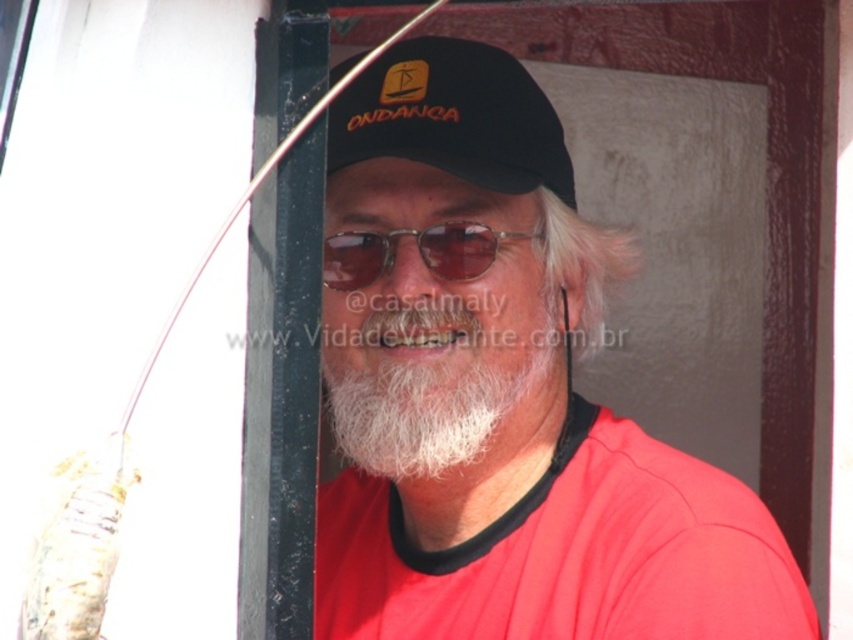
Question: Which object appears closest to the camera in this image?

Choices:
 (A) black matte baseball cap at center
 (B) sunglasses at center

Answer: (A)

Question: Does matte black cap at center have a lesser width compared to sunglasses at center?

Choices:
 (A) yes
 (B) no

Answer: (B)

Question: Which point is closer to the camera taking this photo?

Choices:
 (A) (370, 266)
 (B) (322, 400)
 (C) (519, 65)
 (D) (520, 552)

Answer: (D)

Question: Which point is farther from the camera taking this photo?

Choices:
 (A) pos(490,93)
 (B) pos(357,241)
 (C) pos(321,428)
 (D) pos(494,61)

Answer: (C)

Question: Considering the relative positions of sunglasses at center and white soft beard at center in the image provided, where is sunglasses at center located with respect to white soft beard at center?

Choices:
 (A) below
 (B) above

Answer: (B)

Question: Does sunglasses at center have a smaller size compared to white soft beard at center?

Choices:
 (A) yes
 (B) no

Answer: (A)